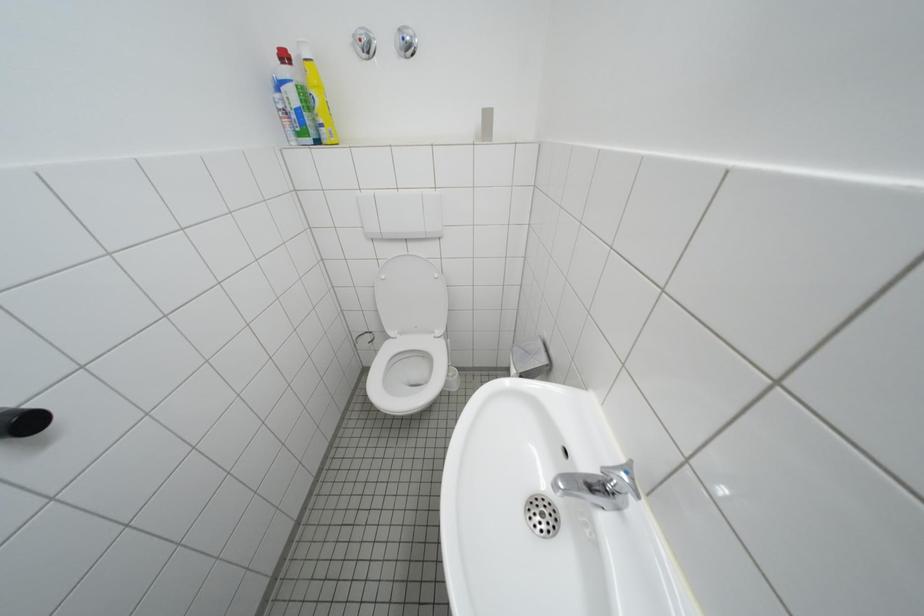
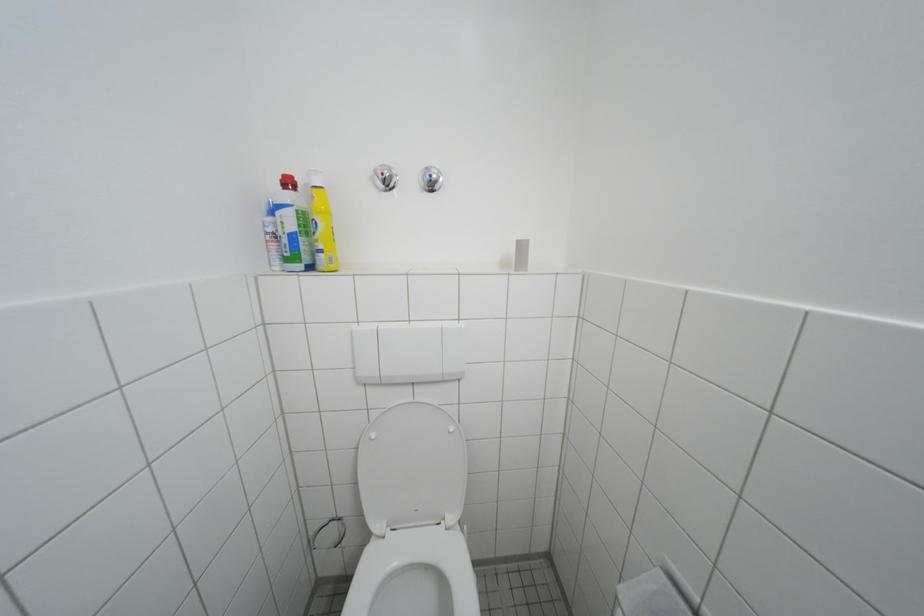
In a continuous first-person perspective shot, in which direction is the camera moving?

The movement direction of the cameraman is left, forward.